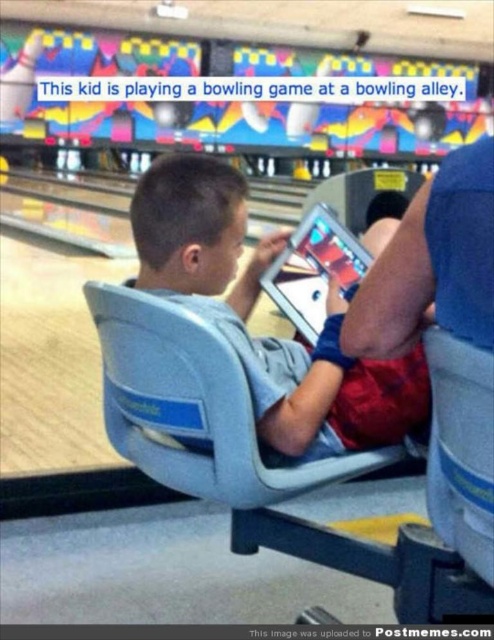
You are a delivery person who needs to place a small package on the silver glossy tablet at center. However, there is a light blue fabric chair at center nearby. Can the package be placed on the tablet without moving the chair?

The light blue fabric chair at center might be wider than the silver glossy tablet at center, so there is a possibility that the chair is blocking access to the tablet. To safely place the package, you should check the space between the chair and the tablet to ensure there is enough room.

You are a delivery robot that needs to place a small package between the gray plastic chair at center and the silver glossy tablet at center. The package requires a minimum of 14 inches of space to fit. Can you fit the package between them?

The gray plastic chair at center and silver glossy tablet at center are 13.96 inches apart from each other, which is less than the required 14 inches. Therefore, the package cannot be placed between them.